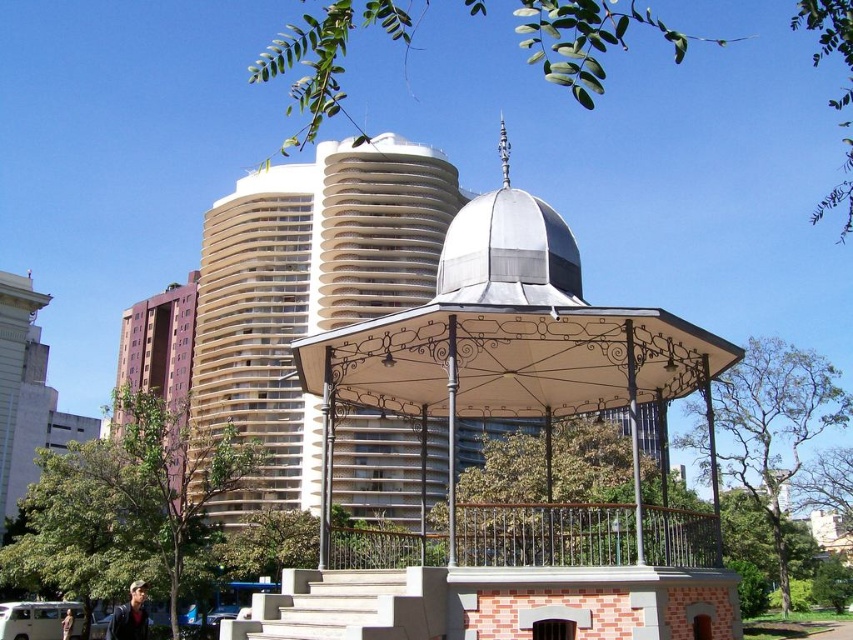
You are an architect evaluating the urban layout. You notice the beige concrete tower at center and the purple matte building at left. Based on their sizes, which one would require more materials for a similar renovation project?

The beige concrete tower at center is bigger than the purple matte building at left, so it would require more materials for a similar renovation project.